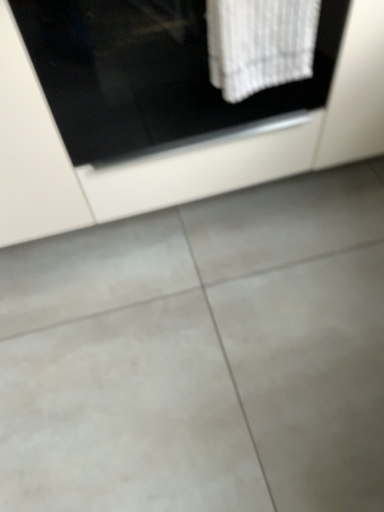
Question: Could you tell me if white textured towel at upper center is facing gray tile floor at center?

Choices:
 (A) yes
 (B) no

Answer: (B)

Question: Does white textured towel at upper center have a lesser width compared to gray tile floor at center?

Choices:
 (A) no
 (B) yes

Answer: (B)

Question: From the image's perspective, is white textured towel at upper center under gray tile floor at center?

Choices:
 (A) no
 (B) yes

Answer: (A)

Question: Considering the relative positions of white textured towel at upper center and gray tile floor at center in the image provided, is white textured towel at upper center to the left of gray tile floor at center from the viewer's perspective?

Choices:
 (A) yes
 (B) no

Answer: (A)

Question: From a real-world perspective, is white textured towel at upper center on gray tile floor at center?

Choices:
 (A) yes
 (B) no

Answer: (A)

Question: From a real-world perspective, relative to gray tile floor at center, is white textured towel at upper center vertically above or below?

Choices:
 (A) below
 (B) above

Answer: (B)

Question: Looking at the image, does white textured towel at upper center seem bigger or smaller compared to gray tile floor at center?

Choices:
 (A) small
 (B) big

Answer: (A)

Question: Is point (284, 25) closer or farther from the camera than point (259, 467)?

Choices:
 (A) farther
 (B) closer

Answer: (B)

Question: From their relative heights in the image, would you say white textured towel at upper center is taller or shorter than gray tile floor at center?

Choices:
 (A) tall
 (B) short

Answer: (A)

Question: From a real-world perspective, is gray tile floor at center physically located above or below white textured towel at upper center?

Choices:
 (A) below
 (B) above

Answer: (A)

Question: Is gray tile floor at center inside the boundaries of white textured towel at upper center, or outside?

Choices:
 (A) inside
 (B) outside

Answer: (B)

Question: Looking at their shapes, would you say gray tile floor at center is wider or thinner than white textured towel at upper center?

Choices:
 (A) thin
 (B) wide

Answer: (B)

Question: Considering the positions of gray tile floor at center and white textured towel at upper center in the image, is gray tile floor at center bigger or smaller than white textured towel at upper center?

Choices:
 (A) small
 (B) big

Answer: (B)

Question: Relative to white glossy cabinet at upper center, is white textured towel at upper center in front or behind?

Choices:
 (A) behind
 (B) front

Answer: (B)

Question: Is white textured towel at upper center taller or shorter than white glossy cabinet at upper center?

Choices:
 (A) short
 (B) tall

Answer: (A)